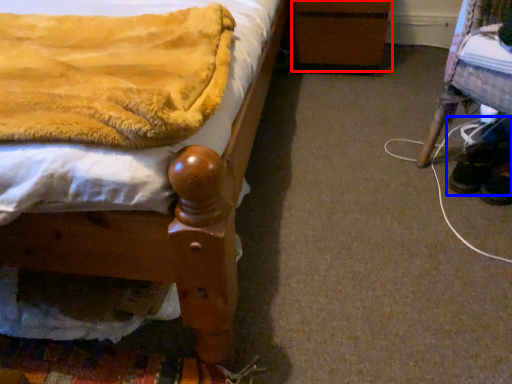
Question: Which point is further to the camera, changing table (highlighted by a red box) or footwear (highlighted by a blue box)?

Choices:
 (A) changing table
 (B) footwear

Answer: (A)